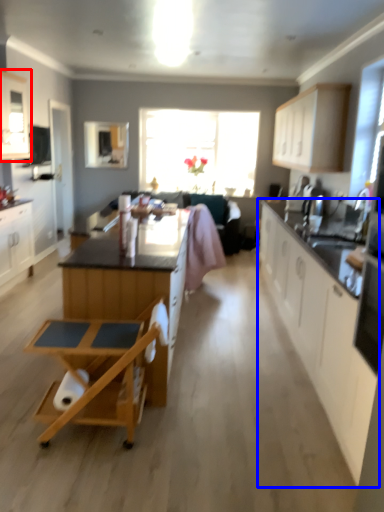
Question: Which object is further to the camera taking this photo, cabinetry (highlighted by a red box) or cabinetry (highlighted by a blue box)?

Choices:
 (A) cabinetry
 (B) cabinetry

Answer: (A)